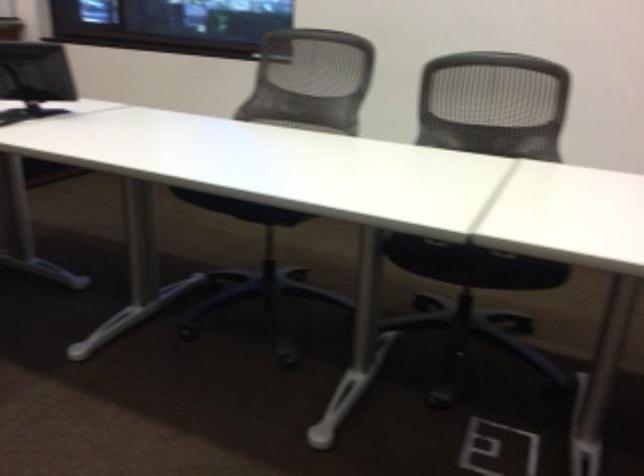
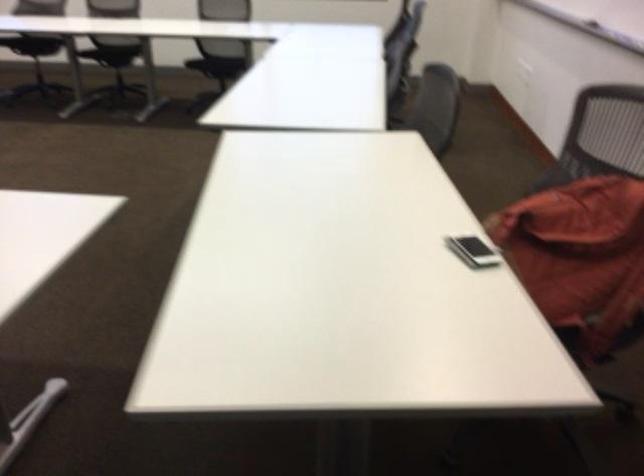
Question: The images are taken continuously from a first-person perspective. In which direction are you moving?

Choices:
 (A) Left
 (B) Right
 (C) Forward
 (D) Backward

Answer: (D)